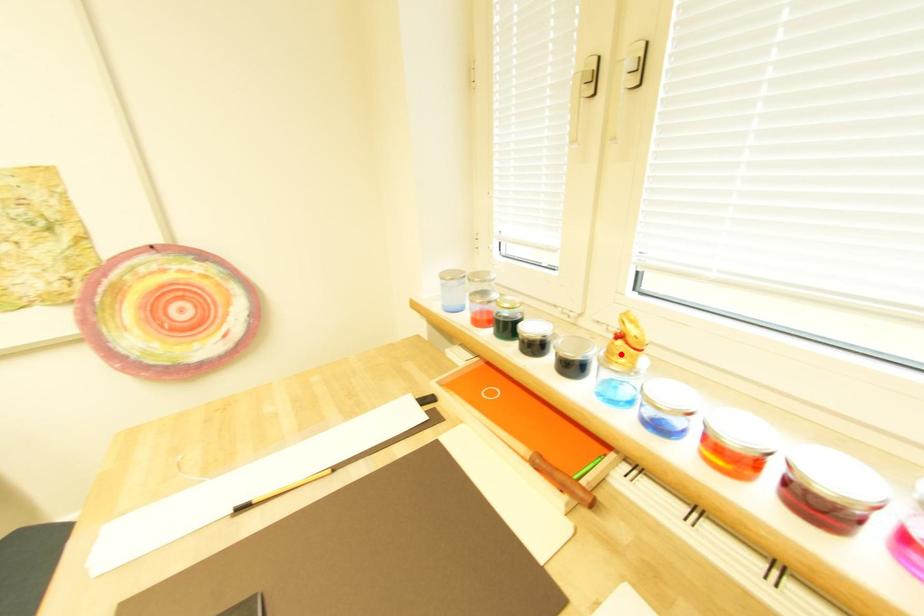
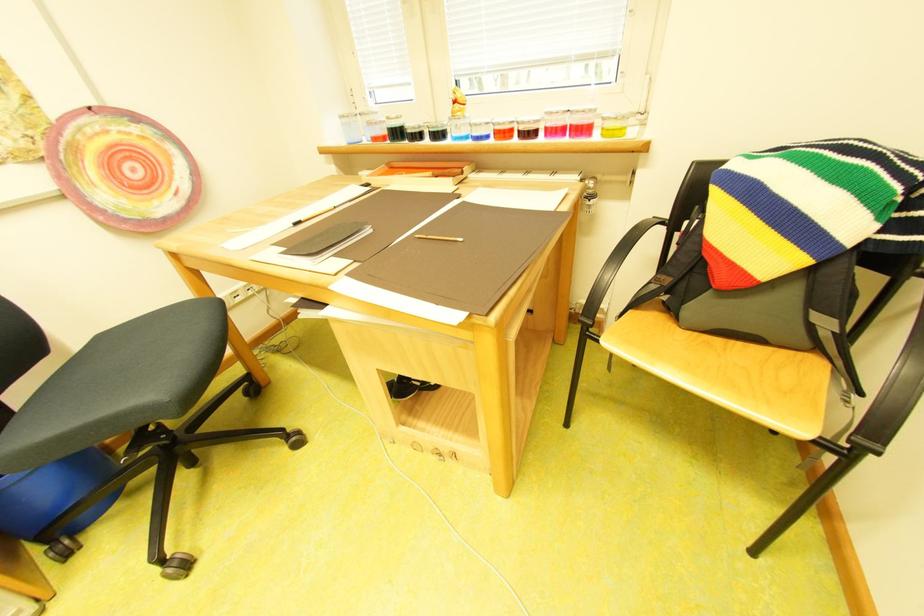
In the second image, find the point that corresponds to the highlighted location in the first image.

(465, 115)